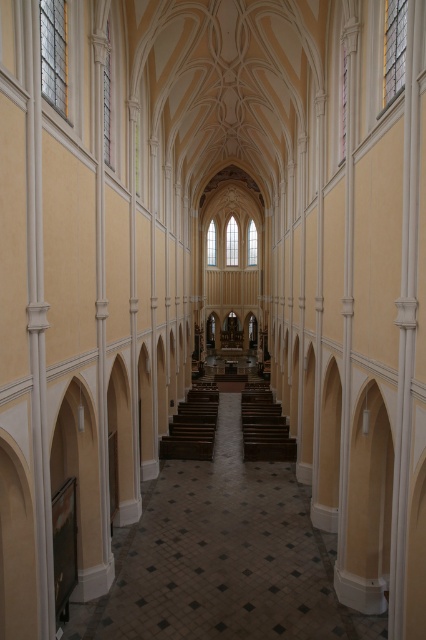
Describe the element at coordinates (192, 424) in the screenshot. I see `brown polished wood stairs at center` at that location.

Who is more distant from viewer, (190, 432) or (249, 390)?

Point (249, 390)

Does point (203, 400) come behind point (282, 417)?

Yes, point (203, 400) is farther from viewer.

What are the coordinates of `brown polished wood stairs at center` in the screenshot? It's located at (192, 424).